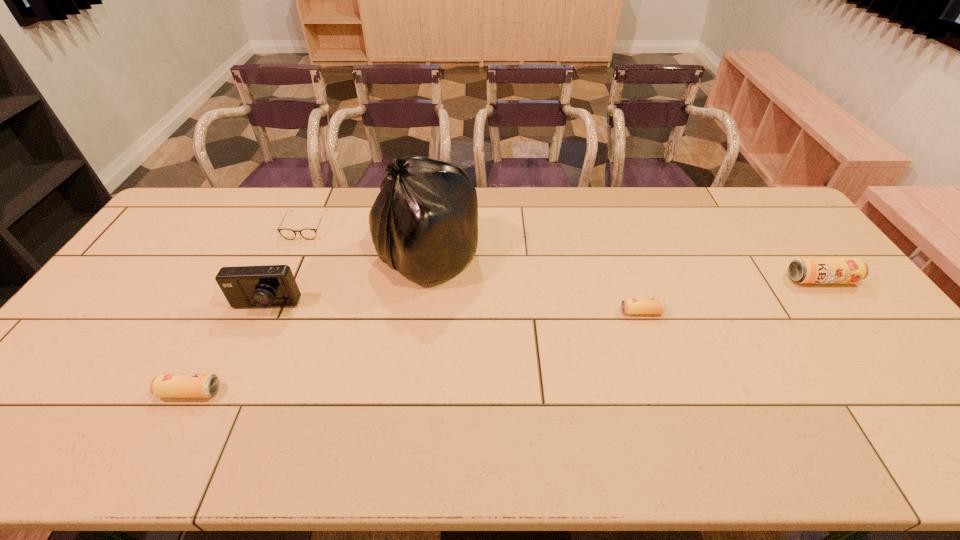
Locate an element on the screen. This screenshot has width=960, height=540. free region at the far edge of the desktop is located at coordinates (507, 199).

In the image, there is a desktop. Where is `vacant space at the left edge`? The height and width of the screenshot is (540, 960). vacant space at the left edge is located at coordinates (142, 272).

In the image, there is a desktop. Identify the location of vacant space at the right edge. The height and width of the screenshot is (540, 960). (805, 247).

In the image, there is a desktop. Where is `vacant space at the far left corner`? This screenshot has height=540, width=960. vacant space at the far left corner is located at coordinates (199, 199).

The image size is (960, 540). In order to click on vacant space that's between the camera and the rightmost object in this screenshot , I will do point(543,293).

Locate an element on the screen. The height and width of the screenshot is (540, 960). empty space that is in between the tallest object and the spectacles is located at coordinates (367, 241).

The width and height of the screenshot is (960, 540). What are the coordinates of `empty space that is in between the second object from right to left and the third tallest object` in the screenshot? It's located at (731, 295).

You are a GUI agent. You are given a task and a screenshot of the screen. Output one action in this format:
    pyautogui.click(x=<x>, y=<y>)
    Task: Click on the vacant space in between the camera and the second tallest beer can
    
    Given the screenshot: What is the action you would take?
    pyautogui.click(x=228, y=349)

Where is `vacant space in between the fifth shortest object and the farthest beer can`? The width and height of the screenshot is (960, 540). vacant space in between the fifth shortest object and the farthest beer can is located at coordinates (543, 293).

In order to click on blank region between the rightmost object and the fifth shortest object in this screenshot , I will do tap(543, 293).